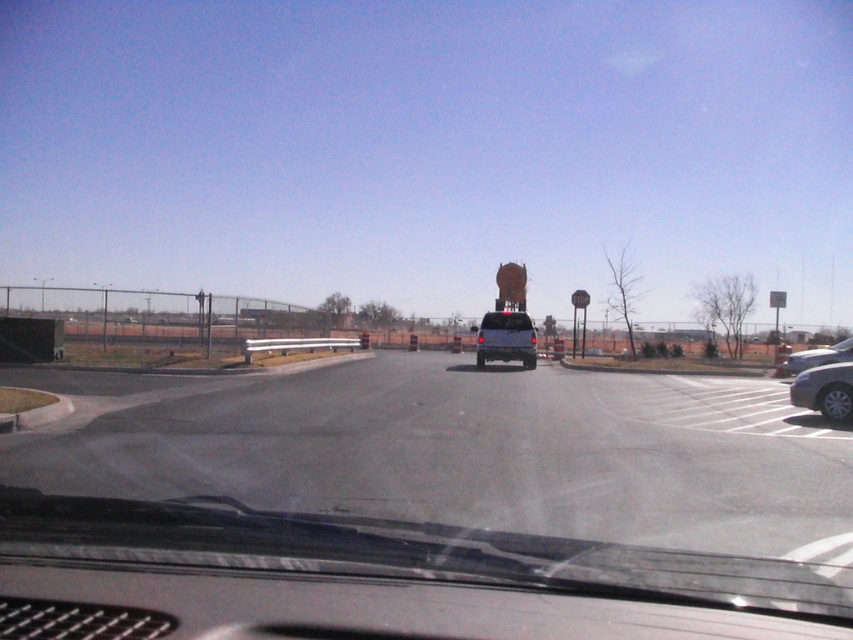
Question: Which point is farther to the camera?

Choices:
 (A) matte black suv at center
 (B) transparent glass windshield at center
 (C) silver metallic sedan at right
 (D) silver metallic sedan at lower right

Answer: (A)

Question: Is transparent glass windshield at center above matte black suv at center?

Choices:
 (A) no
 (B) yes

Answer: (A)

Question: Considering the real-world distances, which object is closest to the silver metallic sedan at right?

Choices:
 (A) transparent glass windshield at center
 (B) silver metallic sedan at lower right
 (C) matte black suv at center

Answer: (C)

Question: Which object is closer to the camera taking this photo?

Choices:
 (A) silver metallic sedan at lower right
 (B) matte black suv at center
 (C) silver metallic sedan at right
 (D) transparent glass windshield at center

Answer: (D)

Question: Is silver metallic sedan at lower right closer to camera compared to matte black suv at center?

Choices:
 (A) yes
 (B) no

Answer: (A)

Question: Is matte black suv at center smaller than silver metallic sedan at right?

Choices:
 (A) no
 (B) yes

Answer: (B)